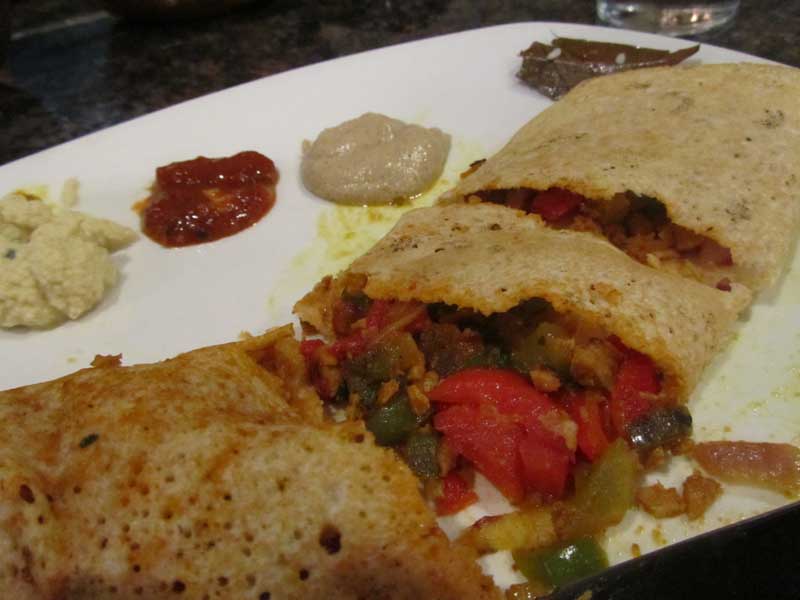
In order to click on plate in this screenshot , I will do `click(358, 108)`.